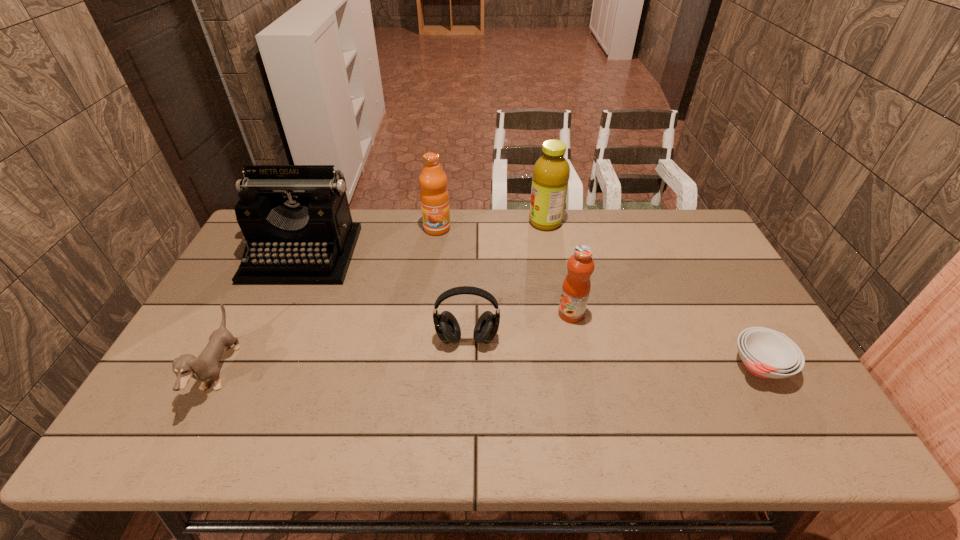
Image resolution: width=960 pixels, height=540 pixels. I want to click on object that is positioned at the right edge, so click(x=766, y=353).

Locate an element on the screen. This screenshot has height=540, width=960. object that is at the far left corner is located at coordinates (296, 220).

This screenshot has width=960, height=540. What are the coordinates of `object located in the near left corner section of the desktop` in the screenshot? It's located at (205, 367).

In the image, there is a desktop. Where is `vacant space at the far edge`? The image size is (960, 540). vacant space at the far edge is located at coordinates (374, 248).

Identify the location of vacant area at the near edge. (480, 433).

You are a GUI agent. You are given a task and a screenshot of the screen. Output one action in this format:
    pyautogui.click(x=<x>, y=<y>)
    Task: Click on the vacant space at the left edge
    
    Given the screenshot: What is the action you would take?
    pyautogui.click(x=162, y=400)

Locate an element on the screen. The height and width of the screenshot is (540, 960). free location at the right edge is located at coordinates (740, 392).

This screenshot has width=960, height=540. Find the location of `vacant space that's between the leftmost fruit juice and the fourth nearest object`. vacant space that's between the leftmost fruit juice and the fourth nearest object is located at coordinates (504, 271).

Identify the location of free space between the rightmost object and the typewriter. (531, 310).

Where is `vacant area between the leftmost fruit juice and the nearest fruit juice`? This screenshot has height=540, width=960. vacant area between the leftmost fruit juice and the nearest fruit juice is located at coordinates (504, 271).